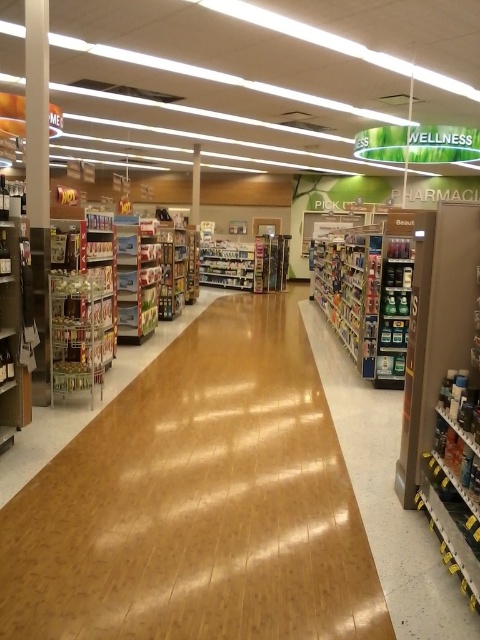
You are standing in the pharmacy section of a store and need to locate the metallic silver shelves at left. According to the store layout, where would you find them?

The metallic silver shelves at left are located at point (82,301) in the store layout.

Consider the image. You are a store employee who needs to place a large display on the left side of the pharmacy section. The display requires a shelf that is wider than the other shelves in the area. Which shelf should you choose between the metallic silver shelves at left and the matte plastic shelves at left?

You should choose the metallic silver shelves at left because their width surpasses that of the matte plastic shelves at left, making them the wider option available.